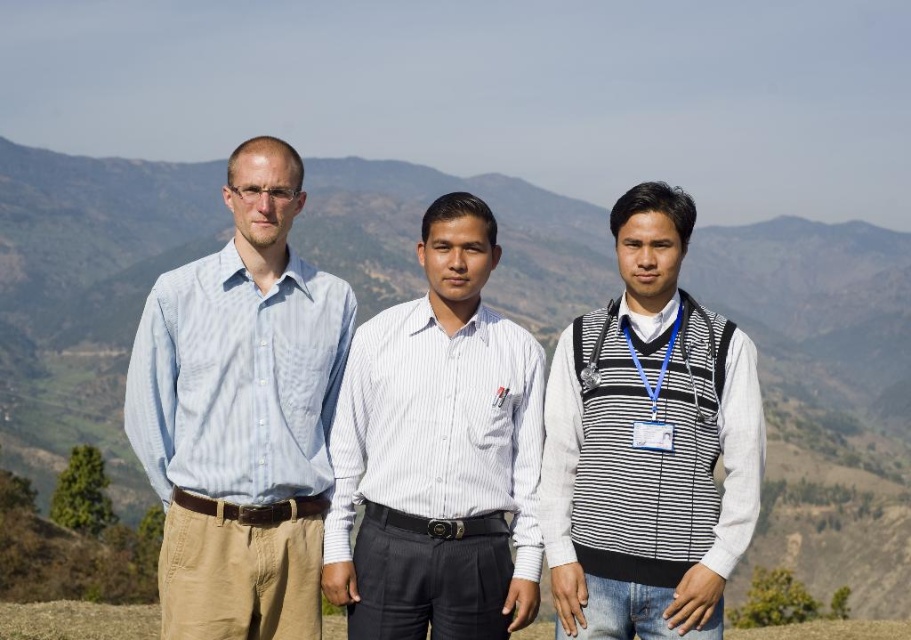
You are a photographer trying to capture a clear photo of the silver metallic medal at center. However, the white striped shirt at center is blocking your view. Can you determine if the medal is above or below the shirt?

The white striped shirt at center is below the silver metallic medal at center, so the medal is above the shirt and should be visible in the photo.

You are a photographer trying to capture a group photo of the three individuals. You want to ensure the white striped shirt at center and the silver metallic medal at center are both visible in the frame. Based on their positions, which object should you focus on first to include both in the shot?

The white striped shirt at center is to the left of the silver metallic medal at center, so you should focus on the silver metallic medal at center first to ensure both objects are included in the frame.

You are standing at the center of the image. Which direction should you move to reach the light blue striped shirt at left?

You should move to the left to reach the light blue striped shirt at left since it is located at point (241, 413), which is to the left of the center position.